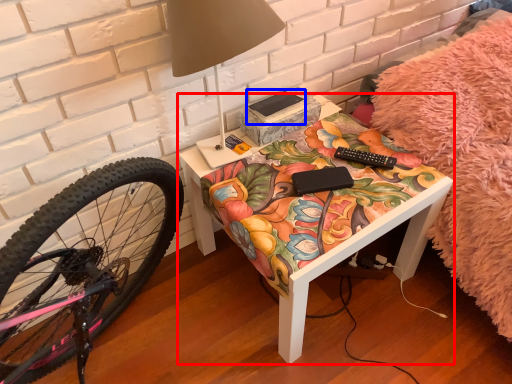
Question: Which object is further to the camera taking this photo, table (highlighted by a red box) or book (highlighted by a blue box)?

Choices:
 (A) table
 (B) book

Answer: (B)